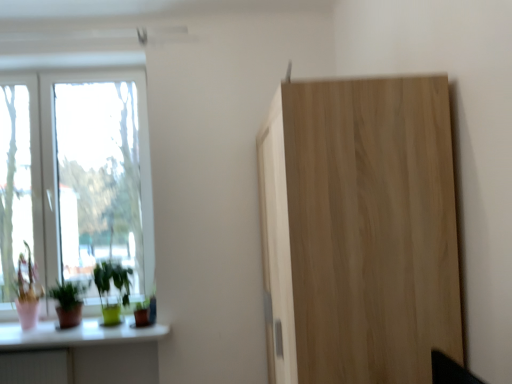
The image size is (512, 384). I want to click on free space that is in between green matte plant at lower left, the 1th houseplant from the left, and green glossy plant at lower left, acting as the second houseplant starting from the left, so click(x=102, y=329).